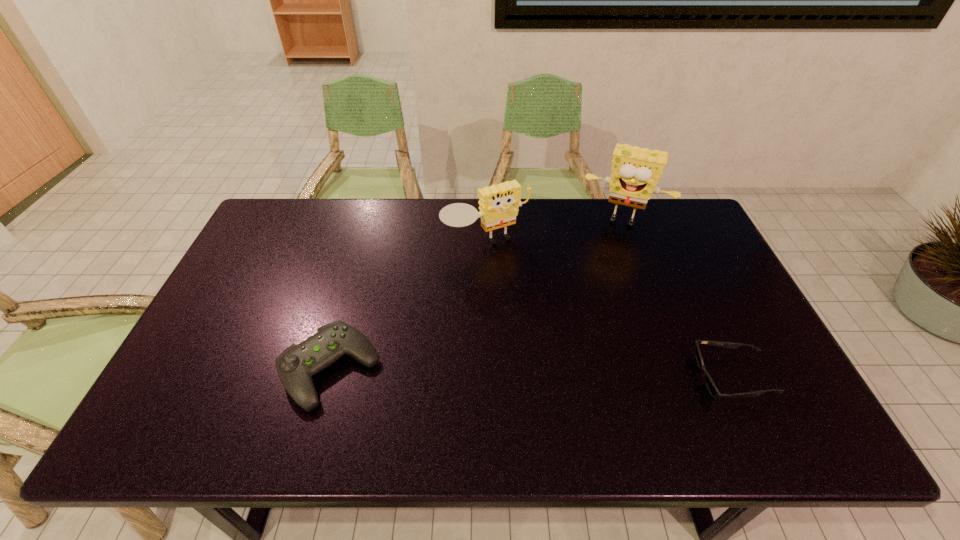
Where is `sponge that is at the right edge`? The width and height of the screenshot is (960, 540). sponge that is at the right edge is located at coordinates (635, 171).

What are the coordinates of `object that is at the far right corner` in the screenshot? It's located at (635, 171).

In order to click on object present at the near right corner in this screenshot , I will do `click(711, 386)`.

Where is `vacant space at the far edge of the desktop`? vacant space at the far edge of the desktop is located at coordinates (521, 206).

What are the coordinates of `free location at the near edge of the desktop` in the screenshot? It's located at (623, 401).

Identify the location of blank space at the left edge. (255, 261).

At what (x,y) coordinates should I click in order to perform the action: click on blank area at the right edge. Please return your answer as a coordinate pair (x, y). Looking at the image, I should click on (711, 248).

The height and width of the screenshot is (540, 960). In the image, there is a desktop. What are the coordinates of `vacant space at the far left corner` in the screenshot? It's located at (291, 208).

Locate an element on the screen. The image size is (960, 540). vacant space at the near left corner of the desktop is located at coordinates (216, 401).

At what (x,y) coordinates should I click in order to perform the action: click on free area in between the right sponge and the shorter sponge. Please return your answer as a coordinate pair (x, y). Image resolution: width=960 pixels, height=540 pixels. Looking at the image, I should click on (554, 232).